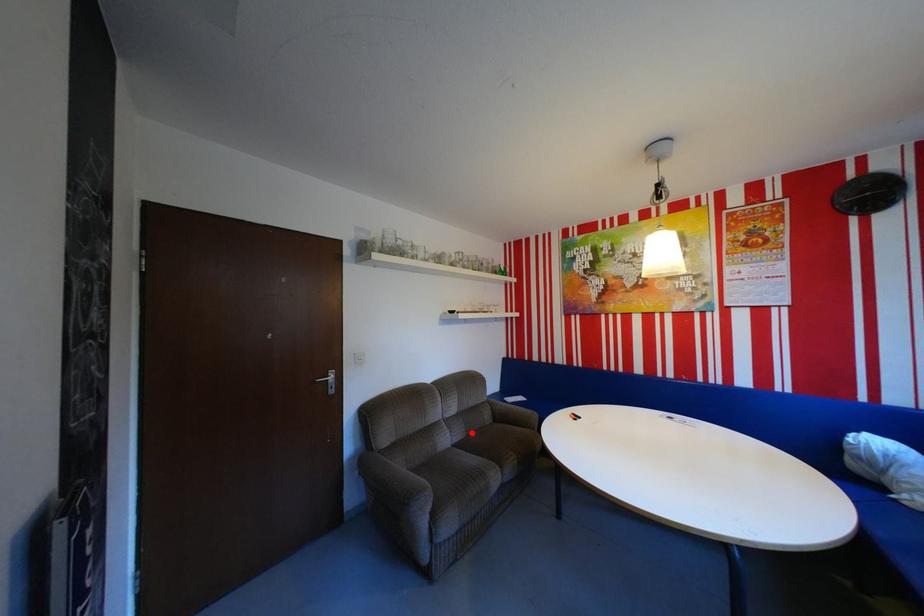
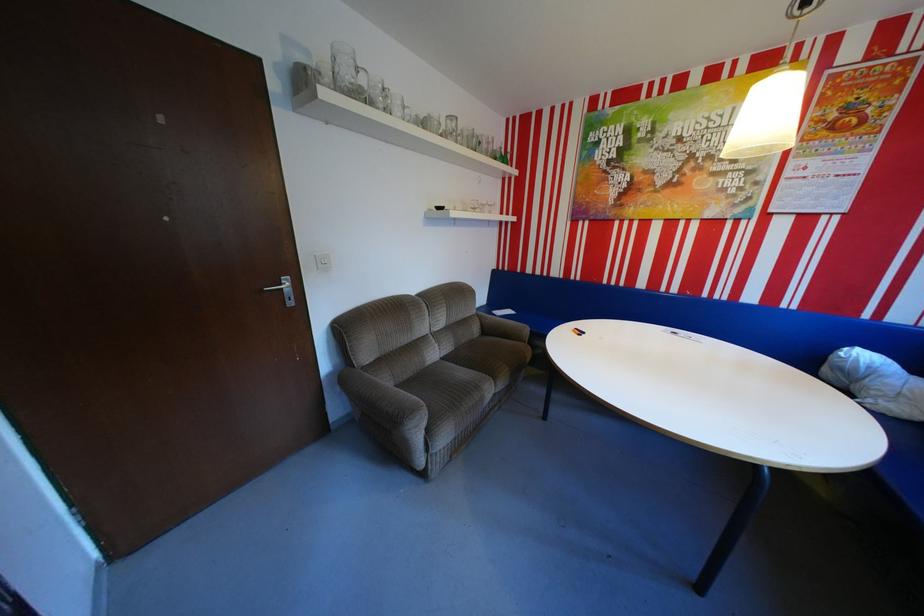
Where in the second image is the point corresponding to the highlighted location from the first image?

(459, 346)